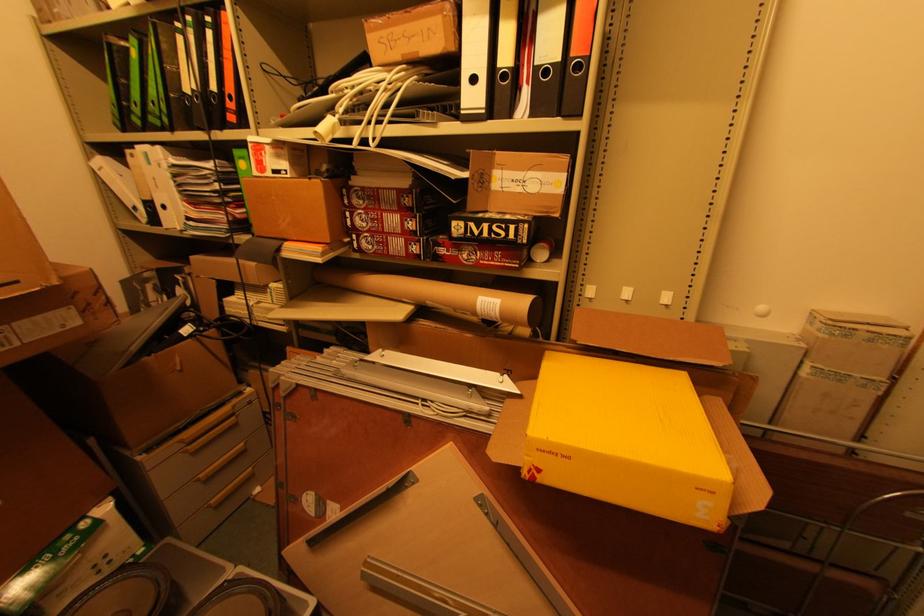
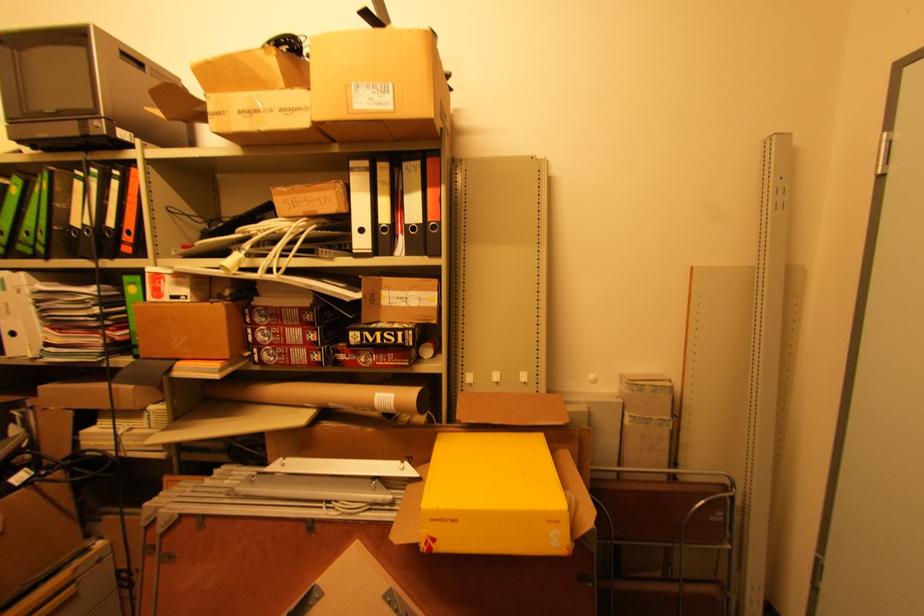
Find the pixel in the second image that matches point 234,106 in the first image.

(131, 238)